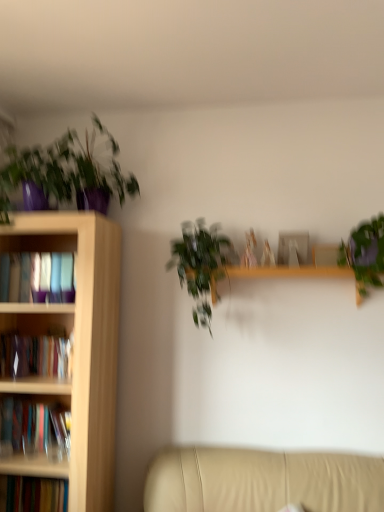
Question: In terms of width, does wooden bookcase at left look wider or thinner when compared to green leafy plant at center, which ranks as the second houseplant in right-to-left order?

Choices:
 (A) wide
 (B) thin

Answer: (A)

Question: From a real-world perspective, is wooden bookcase at left positioned above or below green leafy plant at center, which appears as the 3th houseplant when viewed from the left?

Choices:
 (A) below
 (B) above

Answer: (A)

Question: Which is nearer to the matte purple pot at upper left, which is the 1th houseplant in left-to-right order?

Choices:
 (A) beige leather couch at lower right
 (B) green matte plant at upper right, the first houseplant viewed from the right
 (C) green leafy plant at center, which ranks as the second houseplant in right-to-left order
 (D) matte purple pot at upper left, which is counted as the third houseplant, starting from the right
 (E) wooden bookcase at left

Answer: (D)

Question: Based on their relative distances, which object is nearer to the matte purple pot at upper left, which is counted as the third houseplant, starting from the right?

Choices:
 (A) wooden bookcase at left
 (B) green leafy plant at center, which ranks as the second houseplant in right-to-left order
 (C) green matte plant at upper right, the first houseplant viewed from the right
 (D) beige leather couch at lower right
 (E) matte purple pot at upper left, which is the 1th houseplant in left-to-right order

Answer: (E)